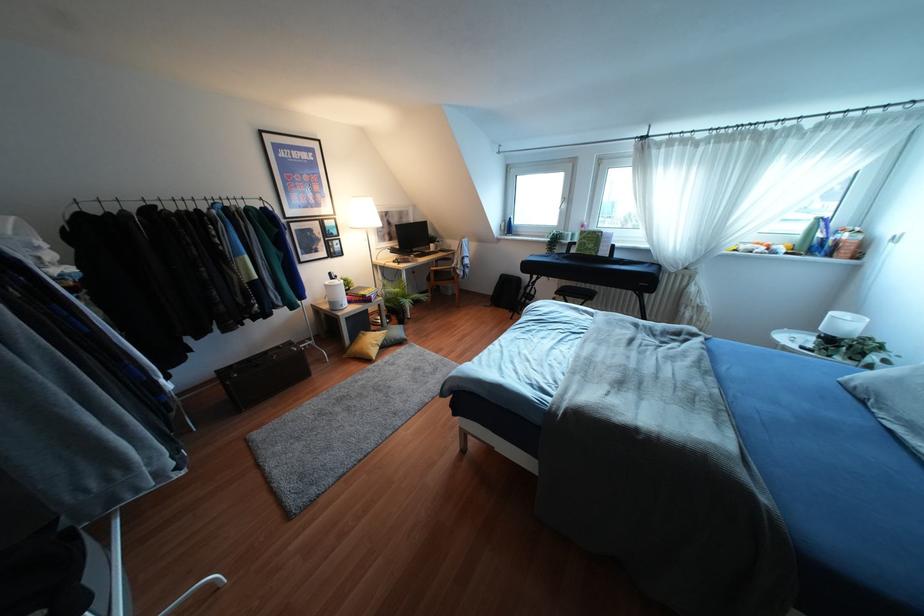
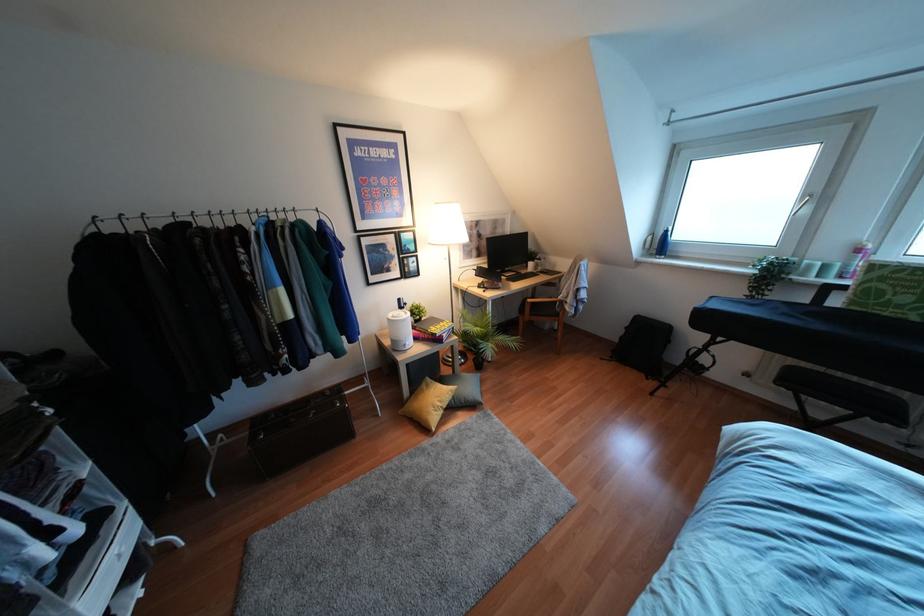
Question: Based on the continuous images, in which direction is the camera rotating? Reply with the corresponding letter.

Choices:
 (A) Left
 (B) Right
 (C) Up
 (D) Down

Answer: (A)